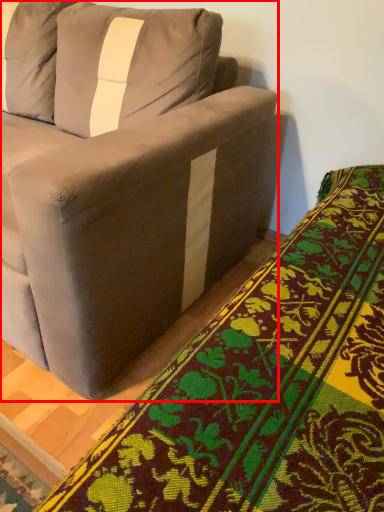
Question: From the image, what is the correct spatial relationship of studio couch (annotated by the red box) in relation to blanket?

Choices:
 (A) right
 (B) left

Answer: (B)